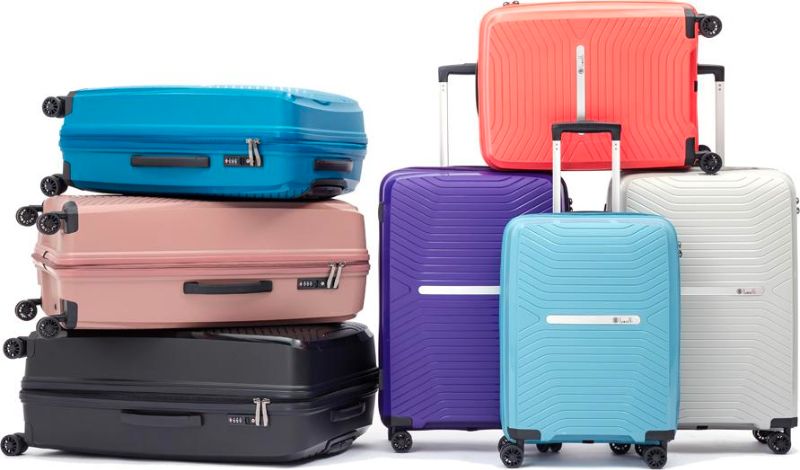
Find the location of a particular element. This screenshot has height=470, width=800. black handles is located at coordinates (156, 419), (226, 287), (164, 161), (350, 413), (338, 163), (330, 189), (462, 69), (586, 128), (713, 68).